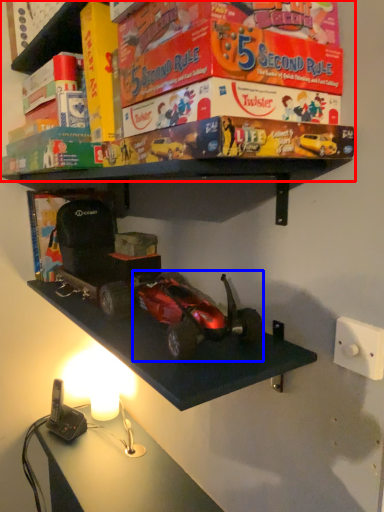
Question: Which of the following is the farthest to the observer, shelf (highlighted by a red box) or model car (highlighted by a blue box)?

Choices:
 (A) shelf
 (B) model car

Answer: (B)